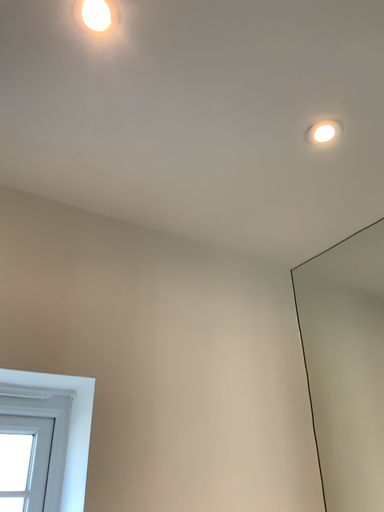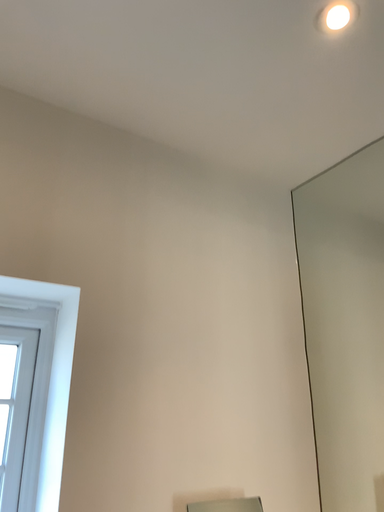
Question: How did the camera likely rotate when shooting the video?

Choices:
 (A) rotated upward
 (B) rotated downward

Answer: (B)